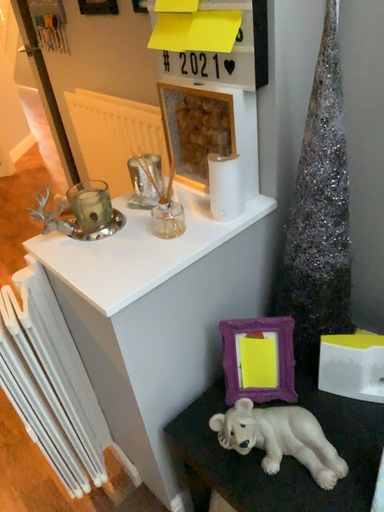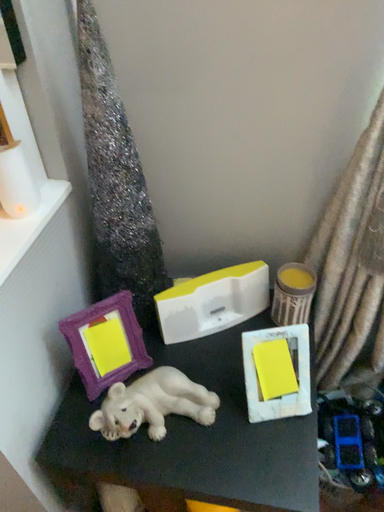
Question: Which way did the camera rotate in the video?

Choices:
 (A) rotated right
 (B) rotated left

Answer: (A)